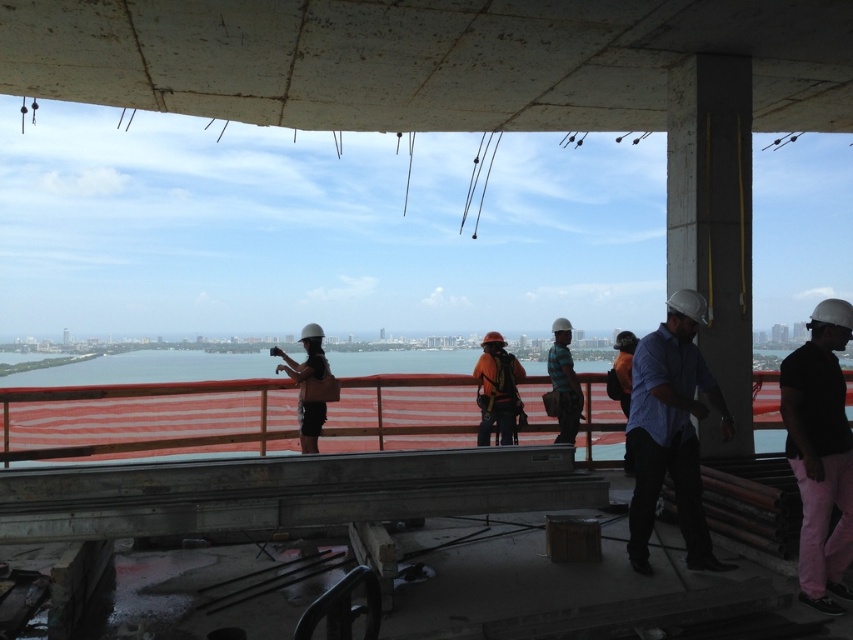
You are a safety inspector at the construction site. You notice the red plastic rail at center and the matte black helmet at center. Which object is shorter in height?

The red plastic rail at center is shorter in height compared to the matte black helmet at center.

You are a safety inspector at the construction site. You need to check if the red plastic rail at center is within the required safety distance of 10 meters from the edge of the structure. Can you confirm if it meets the safety standard?

The red plastic rail at center is 8.89 meters from the camera, but the question is about its distance from the edge of the structure. The provided information does not specify the distance from the edge, so we cannot confirm if it meets the safety standard based on the given data.